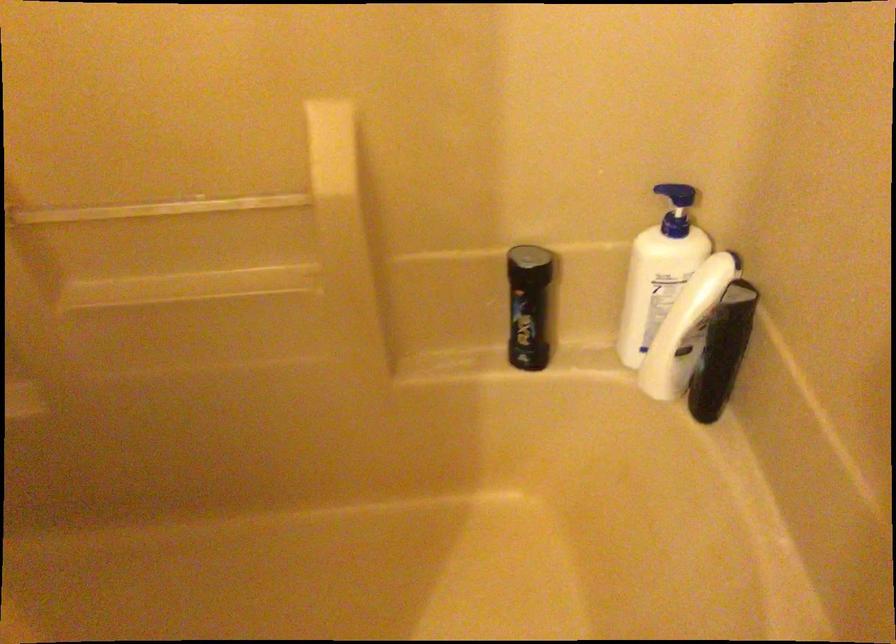
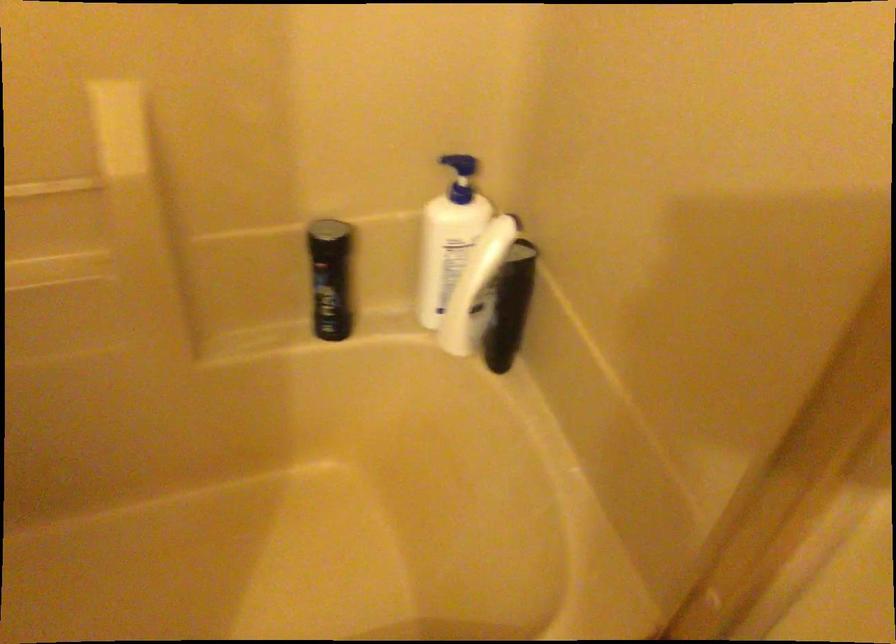
The point at (676, 196) is marked in the first image. Where is the corresponding point in the second image?

(460, 166)